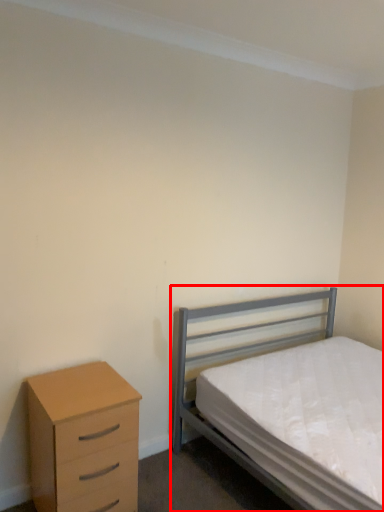
Question: Where is bed (annotated by the red box) located in relation to chest of drawers in the image?

Choices:
 (A) left
 (B) right

Answer: (B)